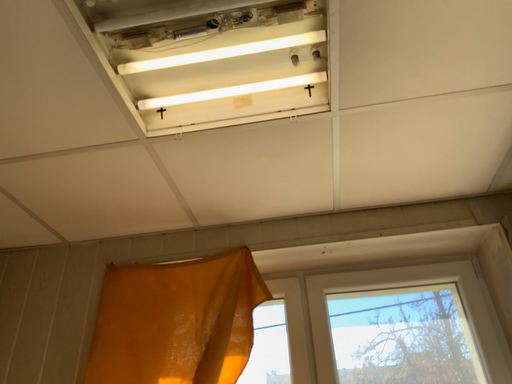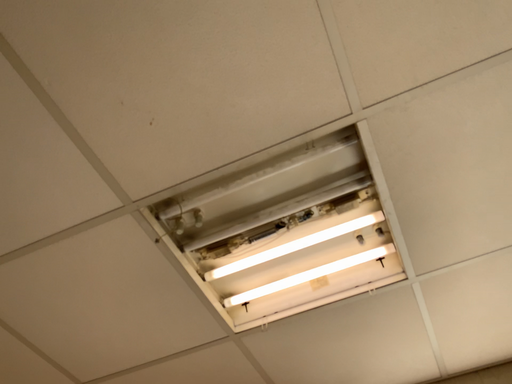
Question: Which way did the camera rotate in the video?

Choices:
 (A) rotated left
 (B) rotated right

Answer: (A)